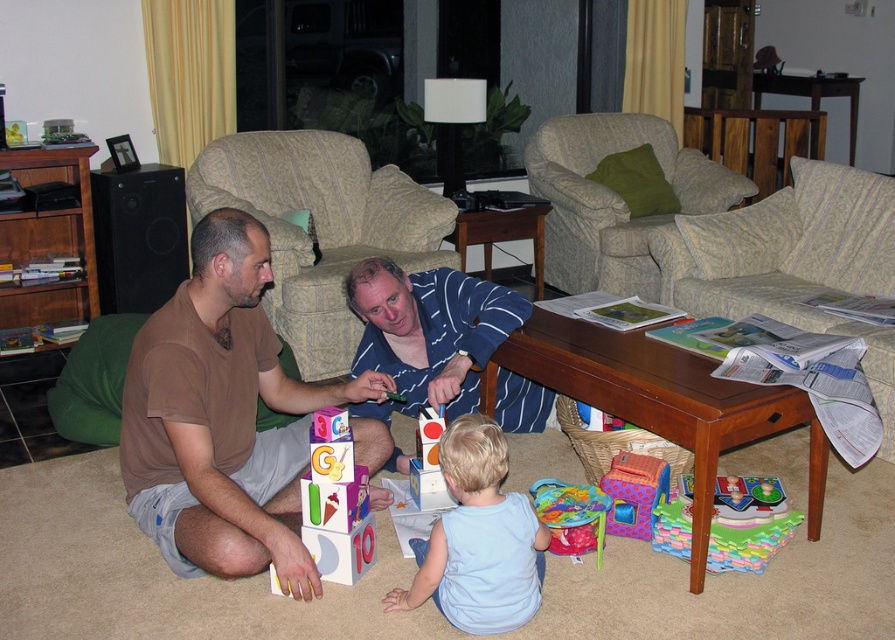
You are a delivery person who needs to place a small package on the plastic colorful playhouse at lower center. The package is 10 cm wide. Can you place it there if the blue striped shirt at center is currently occupying the space?

The blue striped shirt at center is larger in width than the plastic colorful playhouse at lower center. Since the shirt is wider, it might be blocking the playhouse, making it difficult to place the package there. Check if there is space around the shirt.

From the picture: You are a child playing in the living room and want to reach the matte plastic toy at center. There is a plastic colorful playhouse at lower center blocking your path. Can you move around it to get to the toy?

The plastic colorful playhouse at lower center is in front of the matte plastic toy at center, so you can move around it to reach the matte plastic toy at center since it is blocking the direct path.